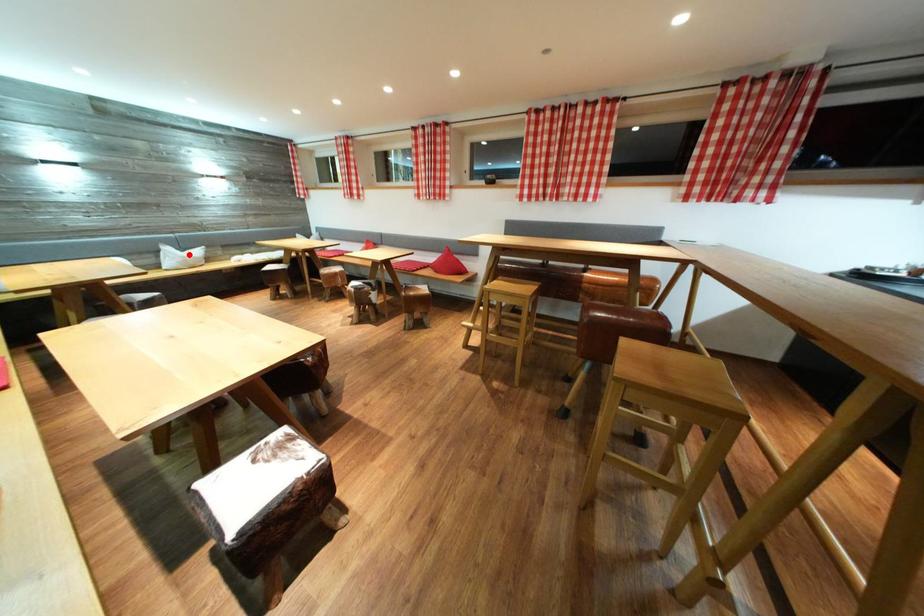
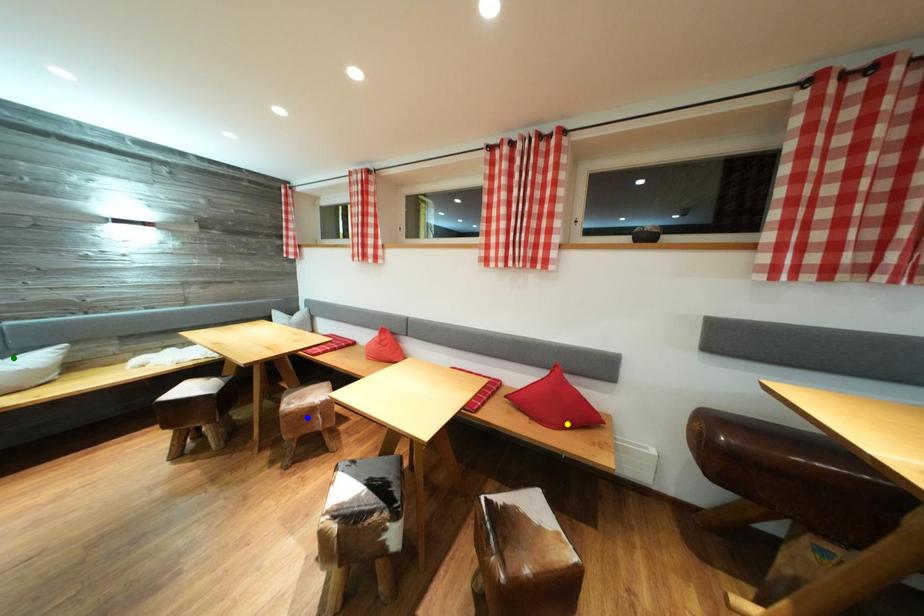
Question: I am providing you with two images of the same scene from different viewpoints. A red point is marked on the first image. You are given multiple points on the second image. In image 2, which mark is for the same physical point as the one in image 1?

Choices:
 (A) blue point
 (B) yellow point
 (C) green point

Answer: (C)